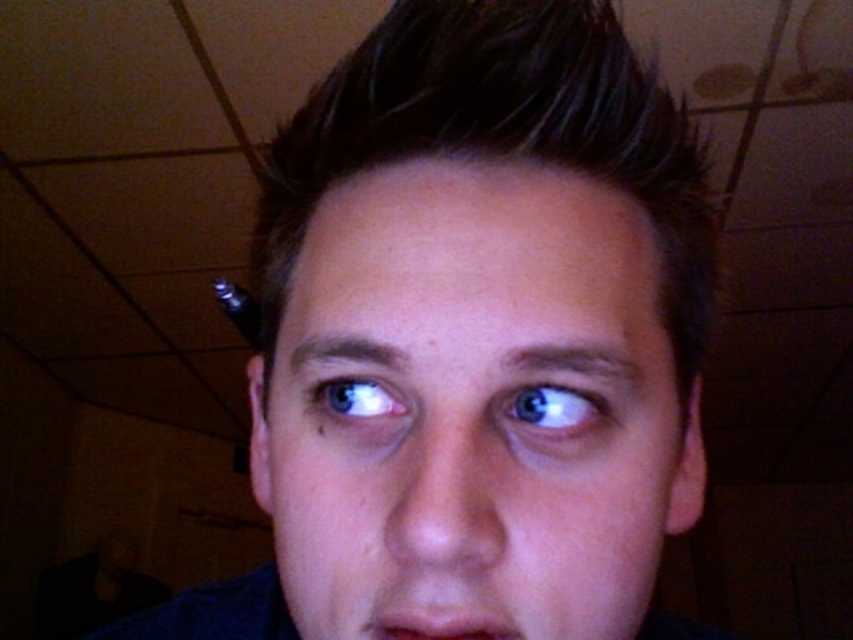
Does smooth skin face at center have a lesser height compared to blue glossy eye at upper center?

Incorrect, smooth skin face at center's height does not fall short of blue glossy eye at upper center's.

Who is positioned more to the left, smooth skin face at center or blue glossy eye at upper center?

From the viewer's perspective, smooth skin face at center appears more on the left side.

Does point (456, 294) come closer to viewer compared to point (560, 419)?

Yes, it is.

What are the coordinates of `smooth skin face at center` in the screenshot? It's located at (473, 401).

Who is more distant from viewer, (x=428, y=26) or (x=389, y=392)?

Point (x=428, y=26)

Between dark brown shiny hair at center and blue glossy eye at center, which one has less height?

blue glossy eye at center

Who is more forward, (x=433, y=122) or (x=401, y=404)?

Point (x=433, y=122) is in front.

Locate an element on the screen. dark brown shiny hair at center is located at coordinates (498, 136).

Does smooth skin face at center have a smaller size compared to matte skin mouth at center?

No, smooth skin face at center is not smaller than matte skin mouth at center.

Is smooth skin face at center above matte skin mouth at center?

Yes, smooth skin face at center is above matte skin mouth at center.

Is point (262, 442) farther from camera compared to point (363, 628)?

Yes.

Identify the location of smooth skin face at center. (473, 401).